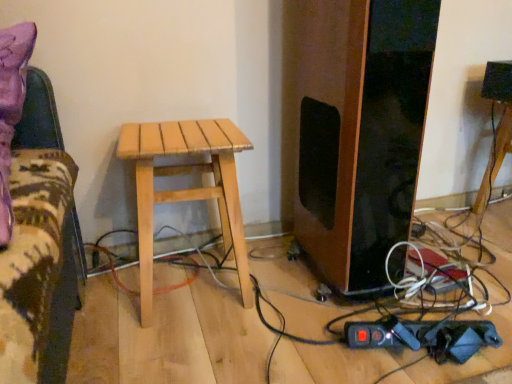
Find the location of a particular element. The height and width of the screenshot is (384, 512). free space to the left of wooden stool at center is located at coordinates (461, 221).